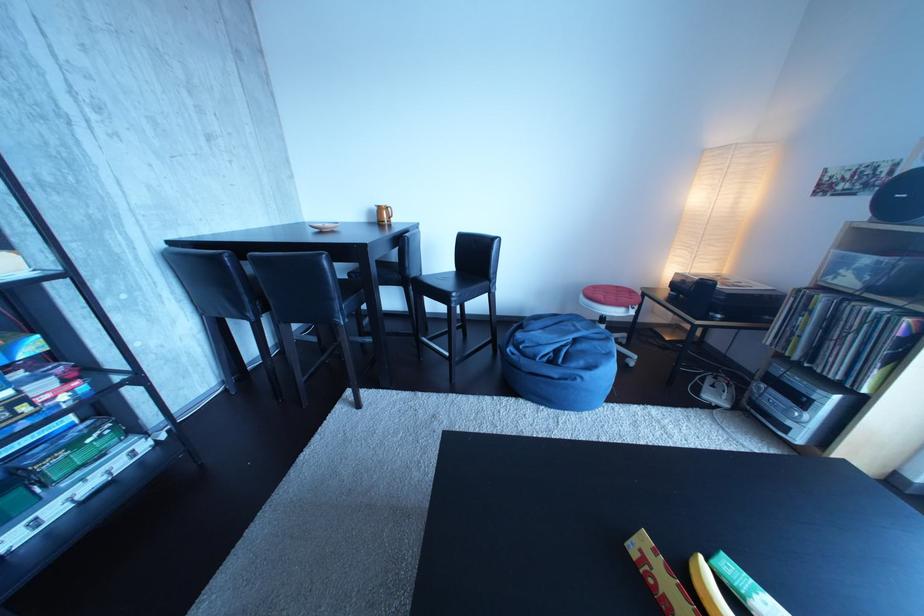
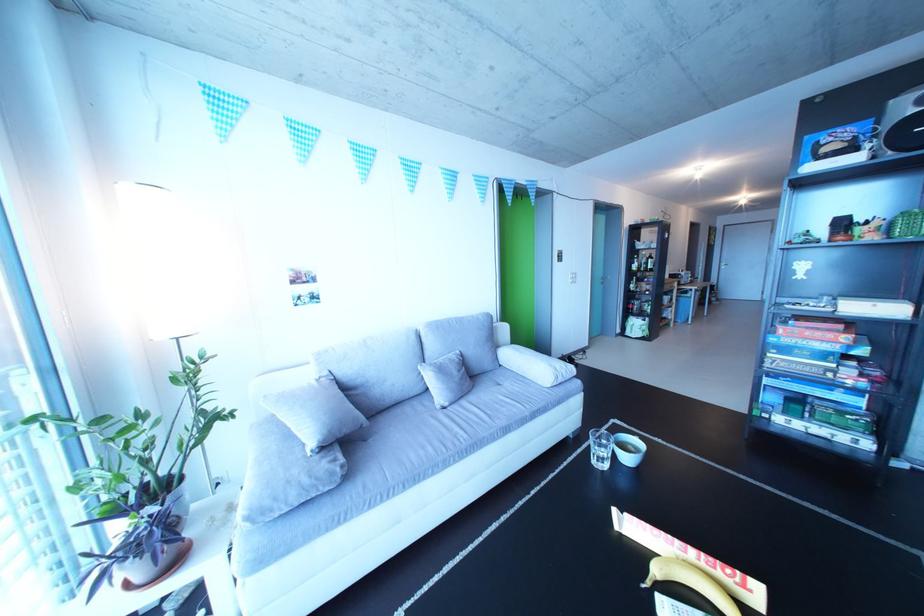
Find the pixel in the second image that matches the point at 157,451 in the first image.

(881, 451)